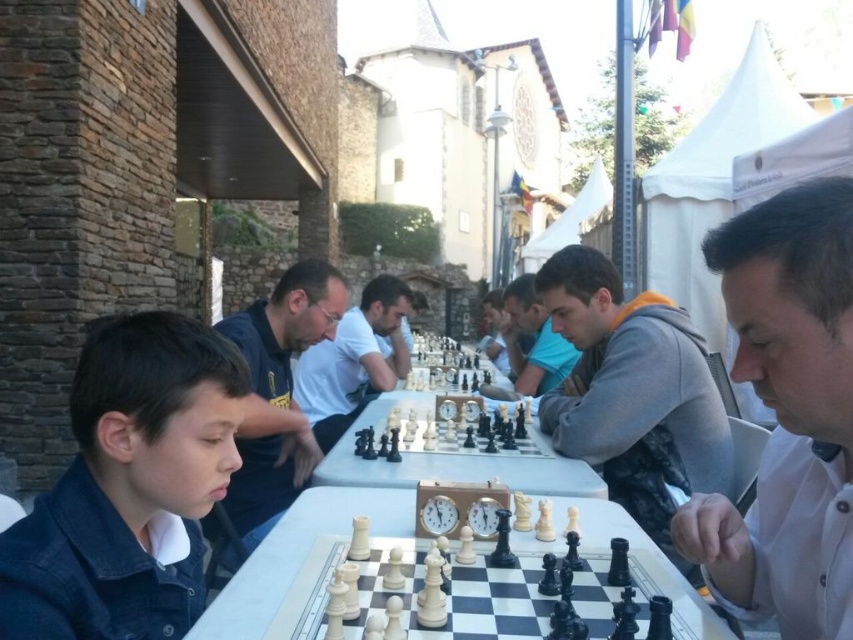
Question: Among these objects, which one is nearest to the camera?

Choices:
 (A) gray fleece jacket at center
 (B) dark blue denim jacket at lower left

Answer: (B)

Question: Is dark blue shirt at center below white shirt at center?

Choices:
 (A) no
 (B) yes

Answer: (A)

Question: Which object is positioned closest to the white shirt at center?

Choices:
 (A) dark blue denim jacket at lower left
 (B) dark blue shirt at center
 (C) gray fleece jacket at center

Answer: (B)

Question: Can you confirm if white shirt at right is bigger than white shirt at center?

Choices:
 (A) no
 (B) yes

Answer: (A)

Question: Which point is farther to the camera?

Choices:
 (A) (529, 333)
 (B) (595, 392)

Answer: (A)

Question: Can you confirm if gray fleece jacket at center is positioned above gray fabric jacket at center?

Choices:
 (A) no
 (B) yes

Answer: (A)